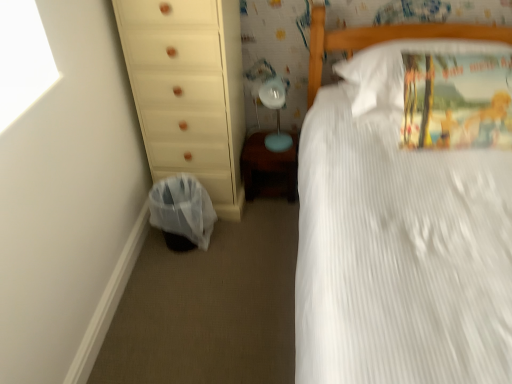
Locate an element on the screen. Image resolution: width=512 pixels, height=384 pixels. vacant space that is to the left of matte blue table lamp at center is located at coordinates (256, 144).